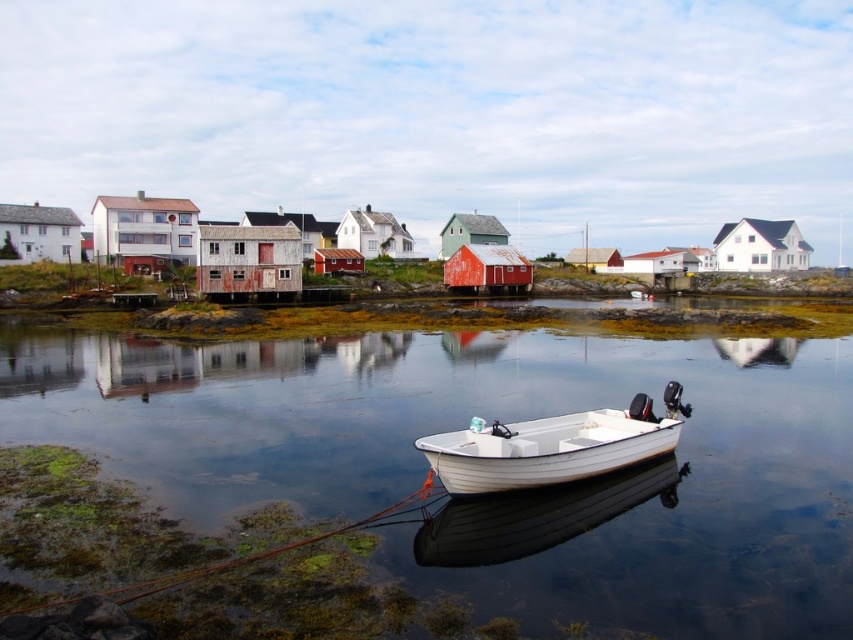
Between clear water at center and white wood boat at center, which one is positioned higher?

clear water at center

Who is positioned more to the right, clear water at center or white wood boat at center?

Positioned to the right is white wood boat at center.

What do you see at coordinates (498, 497) in the screenshot? This screenshot has width=853, height=640. I see `clear water at center` at bounding box center [498, 497].

You are a GUI agent. You are given a task and a screenshot of the screen. Output one action in this format:
    pyautogui.click(x=<x>, y=<y>)
    Task: Click on the clear water at center
    The image size is (853, 640).
    Given the screenshot: What is the action you would take?
    pyautogui.click(x=498, y=497)